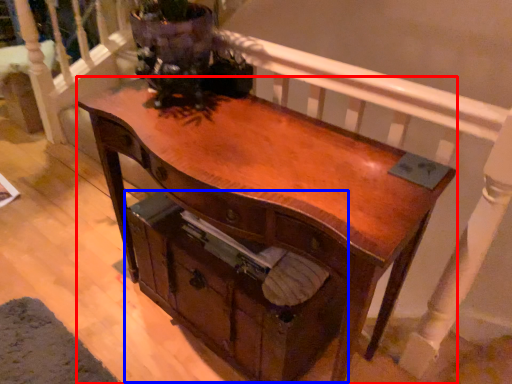
Question: Which object is closer to the camera taking this photo, desk (highlighted by a red box) or drawer (highlighted by a blue box)?

Choices:
 (A) desk
 (B) drawer

Answer: (A)